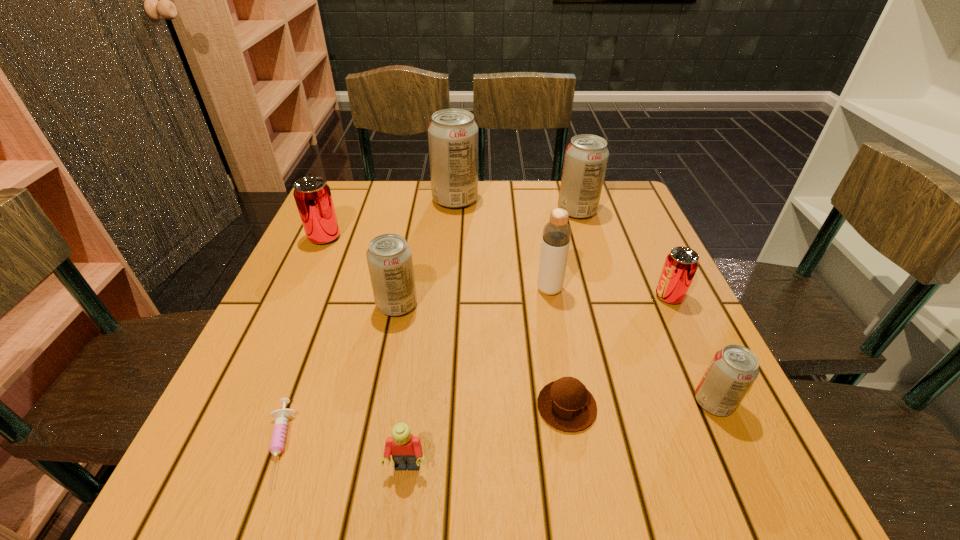
At what (x,y) coordinates should I click in order to perform the action: click on free space located on the back of the second smallest gray soda can. Please return your answer as a coordinate pair (x, y). The image size is (960, 540). Looking at the image, I should click on (415, 216).

Locate an element on the screen. blank area located on the right of the leftmost soda can is located at coordinates (422, 238).

You are a GUI agent. You are given a task and a screenshot of the screen. Output one action in this format:
    pyautogui.click(x=<x>, y=<y>)
    Task: Click on the free space located on the front of the smaller red soda can
    
    Given the screenshot: What is the action you would take?
    pyautogui.click(x=751, y=470)

Locate an element on the screen. vacant space situated on the back of the rightmost gray soda can is located at coordinates (692, 354).

This screenshot has width=960, height=540. Identify the location of free spot located on the back of the brown muffin. (543, 271).

The image size is (960, 540). In order to click on free location located on the right of the syringe in this screenshot , I will do `click(485, 446)`.

Locate an element on the screen. Lego that is at the near edge is located at coordinates (406, 450).

Image resolution: width=960 pixels, height=540 pixels. Find the location of `syringe that is at the near edge`. syringe that is at the near edge is located at coordinates pos(278,437).

Locate an element on the screen. The width and height of the screenshot is (960, 540). soda can present at the left edge is located at coordinates (312, 195).

Identify the location of syringe at the left edge. This screenshot has height=540, width=960. (278, 437).